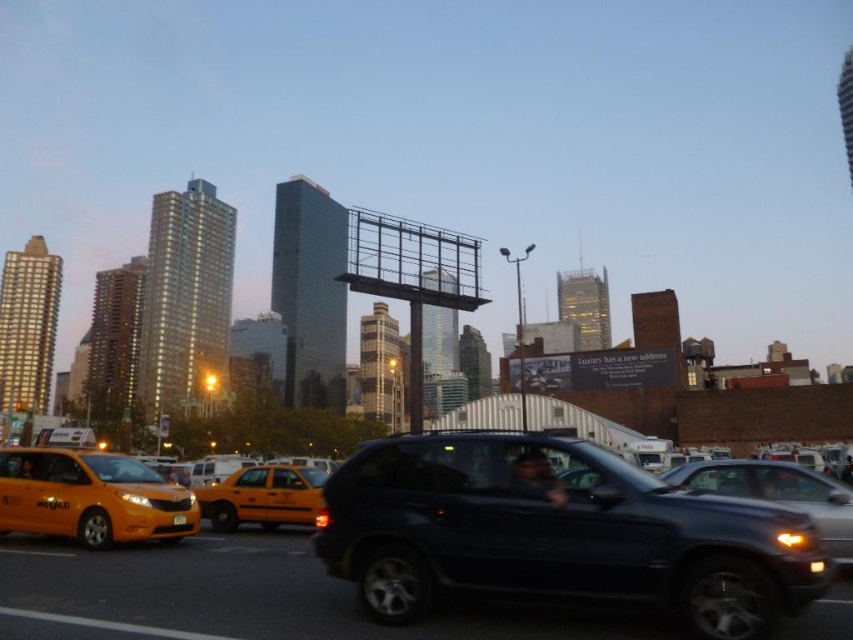
Question: Is shiny black suv at center above yellow plastic license plate at center?

Choices:
 (A) yes
 (B) no

Answer: (A)

Question: Is yellow matte taxi at left closer to camera compared to yellow plastic license plate at center?

Choices:
 (A) yes
 (B) no

Answer: (A)

Question: Which object is the farthest from the yellow matte taxi at center?

Choices:
 (A) shiny black suv at center
 (B) yellow plastic license plate at center
 (C) yellow matte taxi at left

Answer: (A)

Question: Which object is the farthest from the yellow matte taxi at center?

Choices:
 (A) yellow plastic license plate at center
 (B) yellow matte taxi at left

Answer: (A)

Question: Which point appears closest to the camera in this image?

Choices:
 (A) (834, 500)
 (B) (165, 531)

Answer: (A)

Question: Is shiny black suv at center closer to the viewer compared to yellow matte taxi at center?

Choices:
 (A) yes
 (B) no

Answer: (A)